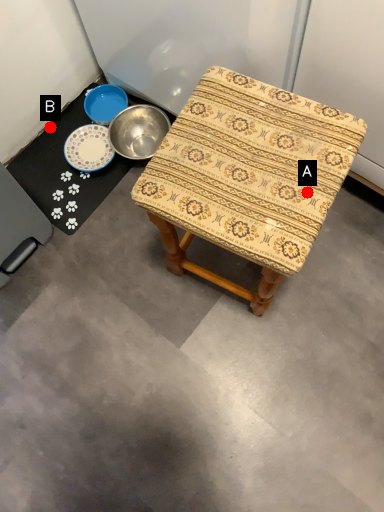
Question: Two points are circled on the image, labeled by A and B beside each circle. Which of the following is the farthest from the observer?

Choices:
 (A) A is further
 (B) B is further

Answer: (B)